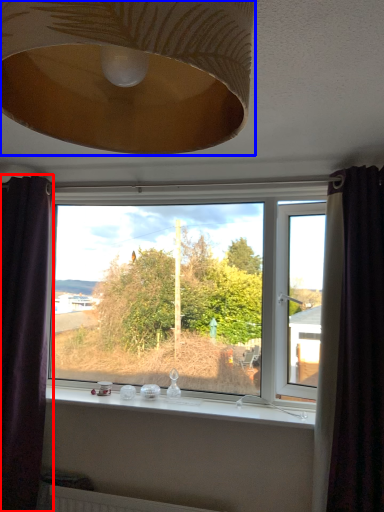
Question: Which object appears farthest to the camera in this image, curtain (highlighted by a red box) or lamp (highlighted by a blue box)?

Choices:
 (A) curtain
 (B) lamp

Answer: (A)